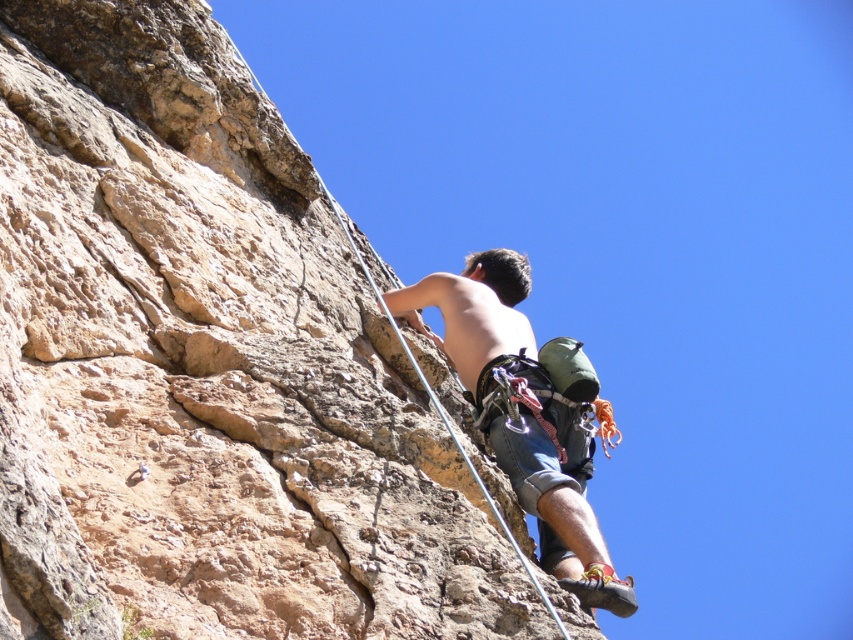
Does brown rough rock at center appear over shiny blue shorts at center?

Indeed, brown rough rock at center is positioned over shiny blue shorts at center.

Is point (262, 536) positioned in front of point (581, 520)?

Yes, it is in front of point (581, 520).

Describe the element at coordinates (206, 365) in the screenshot. I see `brown rough rock at center` at that location.

Where is `brown rough rock at center`? brown rough rock at center is located at coordinates (206, 365).